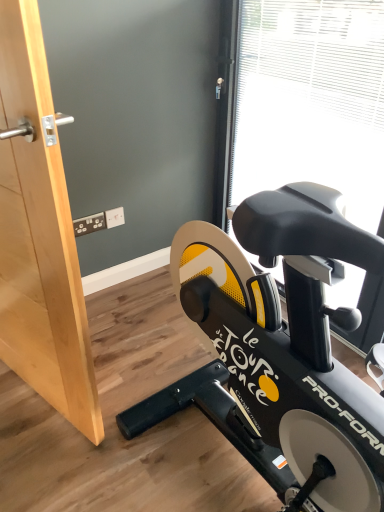
Question: From the image's perspective, is transparent plastic window screen at upper right under wooden door at left?

Choices:
 (A) no
 (B) yes

Answer: (A)

Question: Can you confirm if transparent plastic window screen at upper right is shorter than wooden door at left?

Choices:
 (A) yes
 (B) no

Answer: (B)

Question: Is transparent plastic window screen at upper right bigger than wooden door at left?

Choices:
 (A) no
 (B) yes

Answer: (B)

Question: Is transparent plastic window screen at upper right closer to camera compared to wooden door at left?

Choices:
 (A) yes
 (B) no

Answer: (B)

Question: Does transparent plastic window screen at upper right have a smaller size compared to wooden door at left?

Choices:
 (A) no
 (B) yes

Answer: (A)

Question: Can you confirm if transparent plastic window screen at upper right is taller than wooden door at left?

Choices:
 (A) no
 (B) yes

Answer: (B)

Question: Is transparent plastic window screen at upper right wider than black matte stationary bicycle at lower right?

Choices:
 (A) no
 (B) yes

Answer: (A)

Question: Is transparent plastic window screen at upper right further to camera compared to black matte stationary bicycle at lower right?

Choices:
 (A) no
 (B) yes

Answer: (B)

Question: Is transparent plastic window screen at upper right outside black matte stationary bicycle at lower right?

Choices:
 (A) yes
 (B) no

Answer: (A)

Question: Is transparent plastic window screen at upper right directly adjacent to black matte stationary bicycle at lower right?

Choices:
 (A) no
 (B) yes

Answer: (A)

Question: Does transparent plastic window screen at upper right appear on the right side of black matte stationary bicycle at lower right?

Choices:
 (A) yes
 (B) no

Answer: (A)

Question: Considering the relative positions of transparent plastic window screen at upper right and black matte stationary bicycle at lower right in the image provided, is transparent plastic window screen at upper right to the left of black matte stationary bicycle at lower right from the viewer's perspective?

Choices:
 (A) yes
 (B) no

Answer: (B)

Question: Does black matte stationary bicycle at lower right have a greater height compared to transparent plastic window screen at upper right?

Choices:
 (A) yes
 (B) no

Answer: (B)